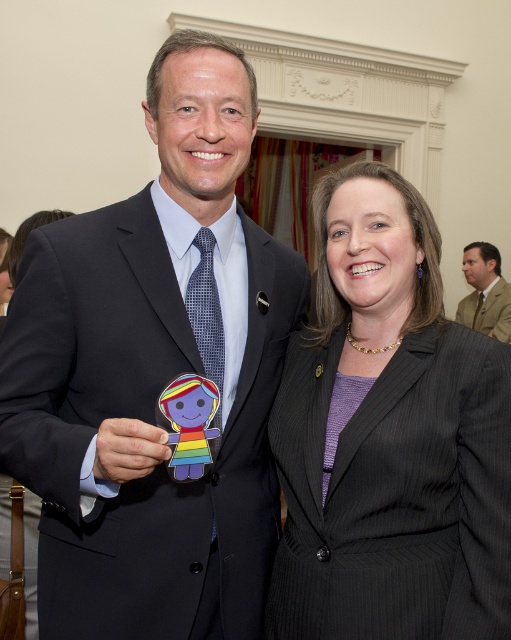
Question: Which object is farther from the camera taking this photo?

Choices:
 (A) matte black suit at center
 (B) black pinstripe suit at center

Answer: (B)

Question: Is black pinstripe suit at center further to camera compared to tan fabric suit at right?

Choices:
 (A) no
 (B) yes

Answer: (A)

Question: Is matte black suit at center further to camera compared to tan fabric suit at right?

Choices:
 (A) no
 (B) yes

Answer: (A)

Question: Considering the real-world distances, which object is farthest from the black pinstripe suit at center?

Choices:
 (A) matte black suit at center
 (B) tan fabric suit at right

Answer: (B)

Question: Based on their relative distances, which object is farther from the matte black suit at center?

Choices:
 (A) black pinstripe suit at center
 (B) rainbow paper doll at center
 (C) tan fabric suit at right

Answer: (C)

Question: Is the position of black pinstripe suit at center less distant than that of rainbow paper doll at center?

Choices:
 (A) yes
 (B) no

Answer: (B)